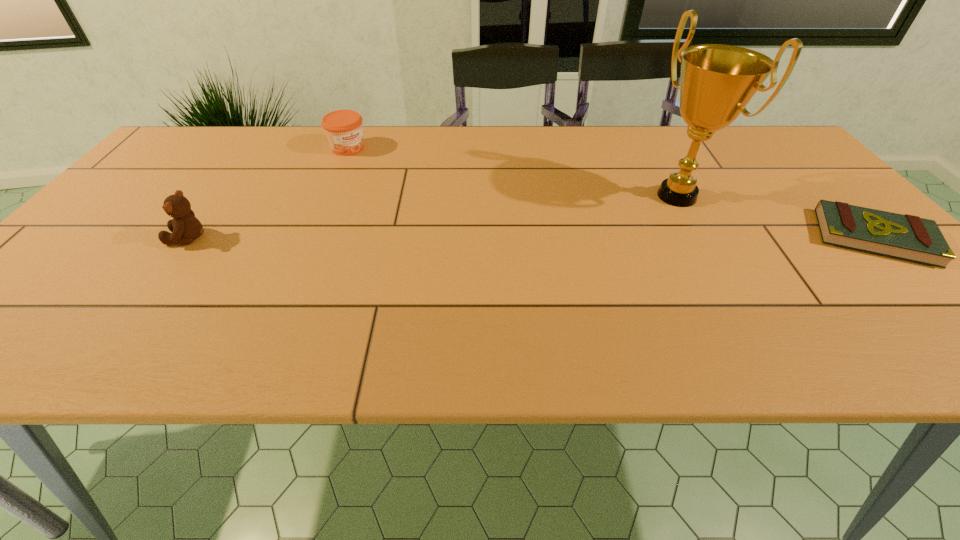
In order to click on the leftmost object in this screenshot , I will do `click(185, 227)`.

Identify the location of the second tallest object. The height and width of the screenshot is (540, 960). (185, 227).

Locate an element on the screen. This screenshot has height=540, width=960. award is located at coordinates (717, 81).

I want to click on the tallest object, so click(x=717, y=81).

Find the location of `the third tallest object`. the third tallest object is located at coordinates (343, 128).

The width and height of the screenshot is (960, 540). Find the location of `the second object from left to right`. the second object from left to right is located at coordinates (343, 128).

You are a GUI agent. You are given a task and a screenshot of the screen. Output one action in this format:
    pyautogui.click(x=<x>, y=<y>)
    Task: Click on the vacant space situated 0.280m on the front view with handles of the tallest object
    
    Given the screenshot: What is the action you would take?
    pyautogui.click(x=568, y=254)

The height and width of the screenshot is (540, 960). I want to click on blank area located on the front view with handles of the tallest object, so coord(623,226).

Identify the location of free location located on the front view with handles of the tallest object. Image resolution: width=960 pixels, height=540 pixels. (579, 249).

At what (x,y) coordinates should I click in order to perform the action: click on vacant region located 0.350m on the front label of the third tallest object. Please return your answer as a coordinate pair (x, y). This screenshot has height=540, width=960. Looking at the image, I should click on (431, 212).